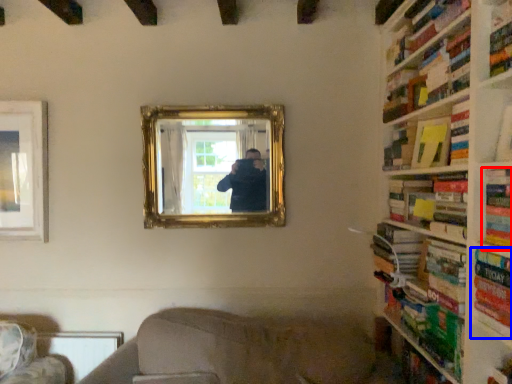
Question: Which object appears farthest to the camera in this image, book (highlighted by a red box) or book (highlighted by a blue box)?

Choices:
 (A) book
 (B) book

Answer: (A)